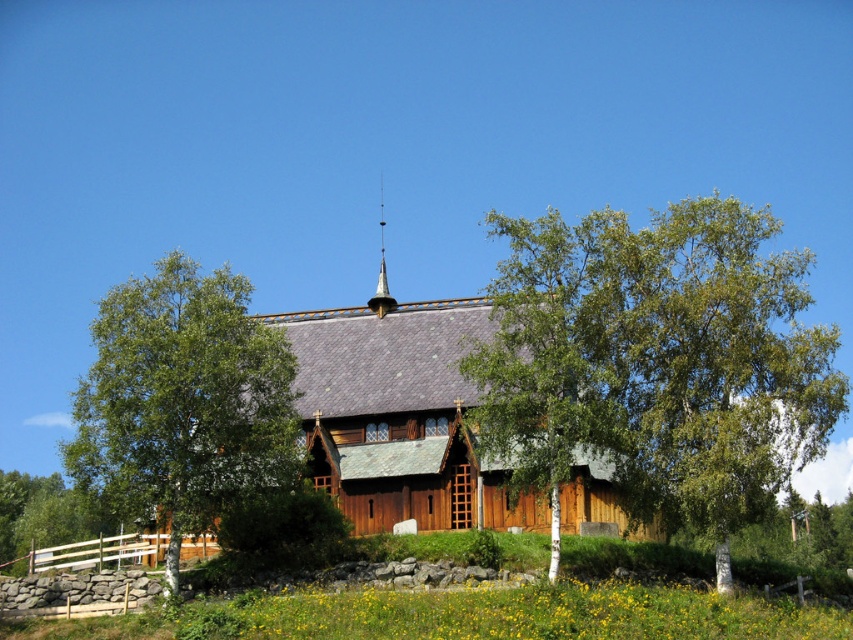
Question: Among these points, which one is farthest from the camera?

Choices:
 (A) (750, 436)
 (B) (170, 445)
 (C) (380, 176)
 (D) (80, 532)

Answer: (C)

Question: Which object appears farthest from the camera in this image?

Choices:
 (A) green leafy tree at lower left
 (B) green leafy tree at center
 (C) wooden church at center
 (D) green leafy tree at left

Answer: (A)

Question: Based on their relative distances, which object is nearer to the green leafy tree at lower left?

Choices:
 (A) shiny gold spire at center top
 (B) green leafy tree at left

Answer: (B)

Question: Can you confirm if green leafy tree at lower left is positioned to the right of shiny gold spire at center top?

Choices:
 (A) yes
 (B) no

Answer: (B)

Question: Can you confirm if green leafy tree at center is positioned above wooden church at center?

Choices:
 (A) no
 (B) yes

Answer: (B)

Question: In this image, where is green leafy tree at left located relative to green leafy tree at lower left?

Choices:
 (A) right
 (B) left

Answer: (A)